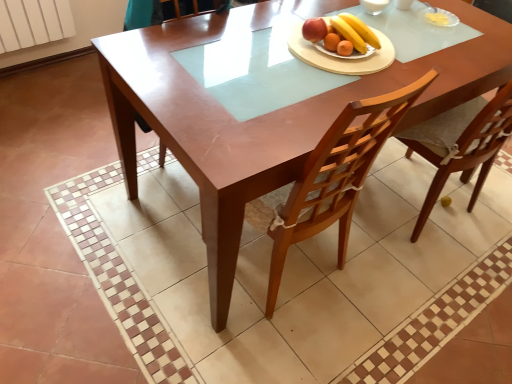
Question: In the image, is shiny white plate with fruits at center positioned in front of or behind wooden table at center?

Choices:
 (A) behind
 (B) front

Answer: (A)

Question: Is shiny white plate with fruits at center spatially inside wooden table at center, or outside of it?

Choices:
 (A) outside
 (B) inside

Answer: (B)

Question: Considering the positions of shiny white plate with fruits at center and wooden table at center in the image, is shiny white plate with fruits at center taller or shorter than wooden table at center?

Choices:
 (A) short
 (B) tall

Answer: (A)

Question: Is point (432, 110) positioned closer to the camera than point (352, 19)?

Choices:
 (A) farther
 (B) closer

Answer: (A)

Question: Considering the positions of wooden table at center and shiny white plate with fruits at center in the image, is wooden table at center bigger or smaller than shiny white plate with fruits at center?

Choices:
 (A) small
 (B) big

Answer: (B)

Question: From the image's perspective, is wooden table at center above or below shiny white plate with fruits at center?

Choices:
 (A) below
 (B) above

Answer: (A)

Question: Is wooden table at center wider or thinner than shiny white plate with fruits at center?

Choices:
 (A) wide
 (B) thin

Answer: (A)